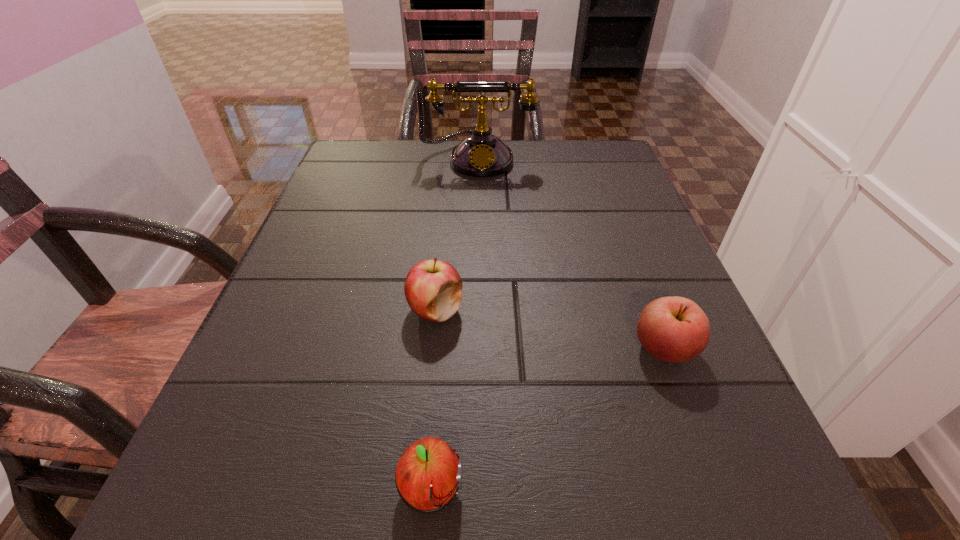
Locate an element on the screen. vacant space at the far edge of the desktop is located at coordinates (430, 187).

The image size is (960, 540). In the image, there is a desktop. Identify the location of vacant space at the left edge. (265, 399).

Where is `vacant space at the right edge`? This screenshot has width=960, height=540. vacant space at the right edge is located at coordinates (745, 449).

In the image, there is a desktop. What are the coordinates of `vacant region at the far left corner` in the screenshot? It's located at (328, 183).

Identify the location of vacant space at the far right corner. The width and height of the screenshot is (960, 540). (589, 177).

The width and height of the screenshot is (960, 540). I want to click on vacant space at the near right corner of the desktop, so click(x=690, y=480).

Image resolution: width=960 pixels, height=540 pixels. Find the location of `free spot between the rightmost object and the nearest apple`. free spot between the rightmost object and the nearest apple is located at coordinates (547, 420).

What are the coordinates of `empty space that is in between the nearest apple and the telephone` in the screenshot? It's located at (454, 324).

You are a GUI agent. You are given a task and a screenshot of the screen. Output one action in this format:
    pyautogui.click(x=<x>, y=<y>)
    Task: Click on the free point between the rightmost apple and the tallest object
    
    Given the screenshot: What is the action you would take?
    pyautogui.click(x=571, y=253)

Identify the location of empty space between the tallest object and the rightmost apple. (571, 253).